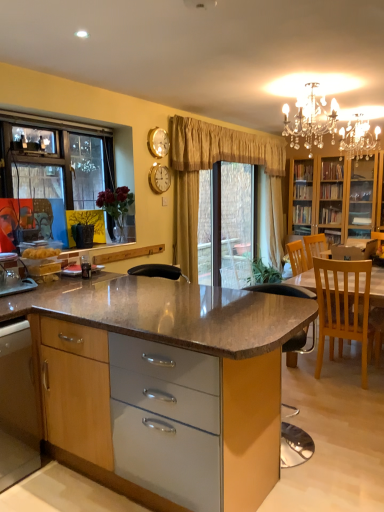
Question: From a real-world perspective, is wooden/textured cabinet at center, positioned as the 2th cabinetry in left-to-right order, positioned above or below clear plastic window screen at center?

Choices:
 (A) above
 (B) below

Answer: (B)

Question: In the image, is wooden/textured cabinet at center, positioned as the 2th cabinetry in left-to-right order, on the left side or the right side of clear plastic window screen at center?

Choices:
 (A) left
 (B) right

Answer: (A)

Question: Which of these objects is positioned closest to the crystal chandelier at upper center?

Choices:
 (A) gold metallic clock at upper center
 (B) wooden cabinet at lower left, acting as the 1th cabinetry starting from the left
 (C) wooden/textured cabinet at center, positioned as the 2th cabinetry in left-to-right order
 (D) clear plastic window screen at center
 (E) beige fabric curtain at center

Answer: (E)

Question: Which object is the closest to the beige fabric curtain at center?

Choices:
 (A) clear plastic window screen at center
 (B) wooden cabinet at lower left, the 2th cabinetry from the right
 (C) light wood chair at right
 (D) wooden/textured cabinet at center, positioned as the 2th cabinetry in left-to-right order
 (E) crystal chandelier at upper center

Answer: (A)